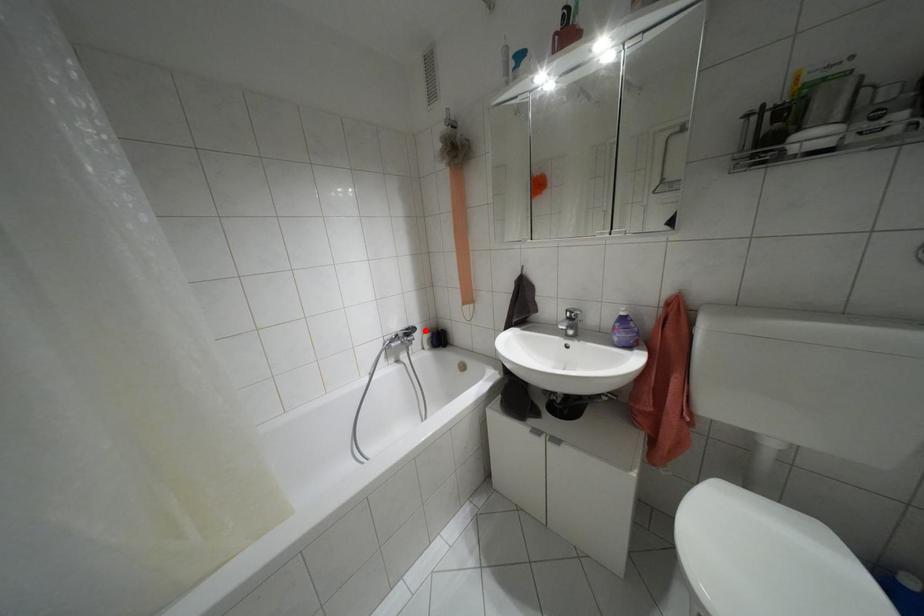
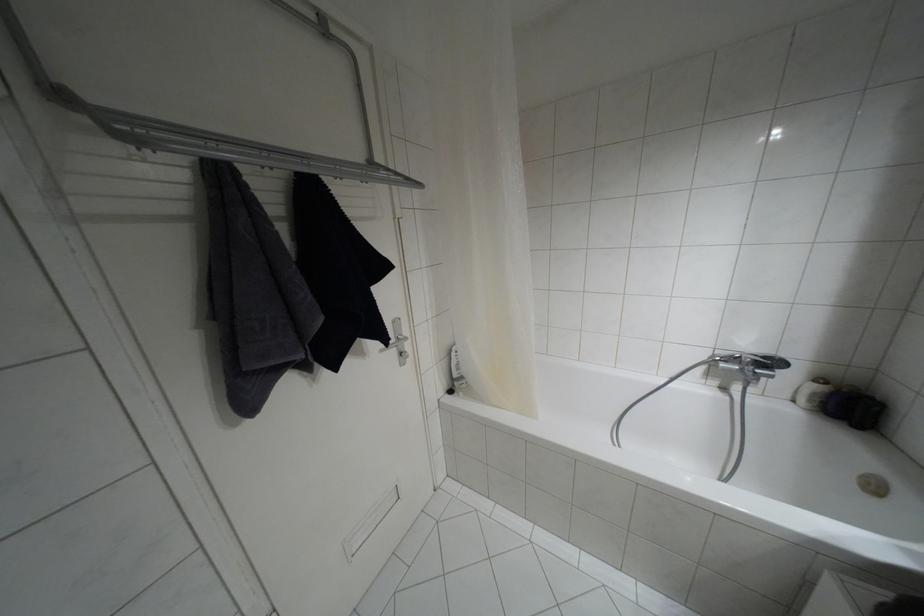
Where in the second image is the point corresponding to the highlighted location from the first image?

(820, 379)